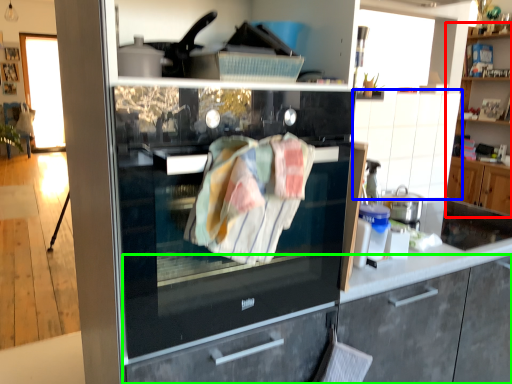
Question: Which object is positioned closest to cabinetry (highlighted by a red box)? Select from cabinetry (highlighted by a blue box) and cabinetry (highlighted by a green box).

Choices:
 (A) cabinetry
 (B) cabinetry

Answer: (A)